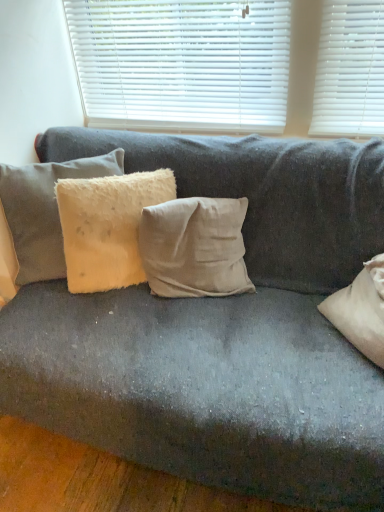
Question: From the image's perspective, relative to fuzzy beige pillow at center, the 2th pillow from the right, is fuzzy beige pillow at left, the third pillow when ordered from right to left, above or below?

Choices:
 (A) above
 (B) below

Answer: (A)

Question: Which is correct: fuzzy beige pillow at left, which appears as the 1th pillow when viewed from the left, is inside fuzzy beige pillow at center, arranged as the 2th pillow when viewed from the left, or outside of it?

Choices:
 (A) inside
 (B) outside

Answer: (B)

Question: Estimate the real-world distances between objects in this image. Which object is farther from the white plastic blinds at upper center?

Choices:
 (A) fuzzy beige pillow at center, the 2th pillow from the right
 (B) fuzzy beige pillow at left, the third pillow when ordered from right to left
 (C) beige cotton cushion at center, which is counted as the first pillow, starting from the right

Answer: (C)

Question: Estimate the real-world distances between objects in this image. Which object is closer to the fuzzy beige pillow at center, arranged as the 2th pillow when viewed from the left?

Choices:
 (A) white plastic blinds at upper center
 (B) beige cotton cushion at center, which is counted as the first pillow, starting from the right
 (C) fuzzy beige pillow at left, the third pillow when ordered from right to left

Answer: (B)